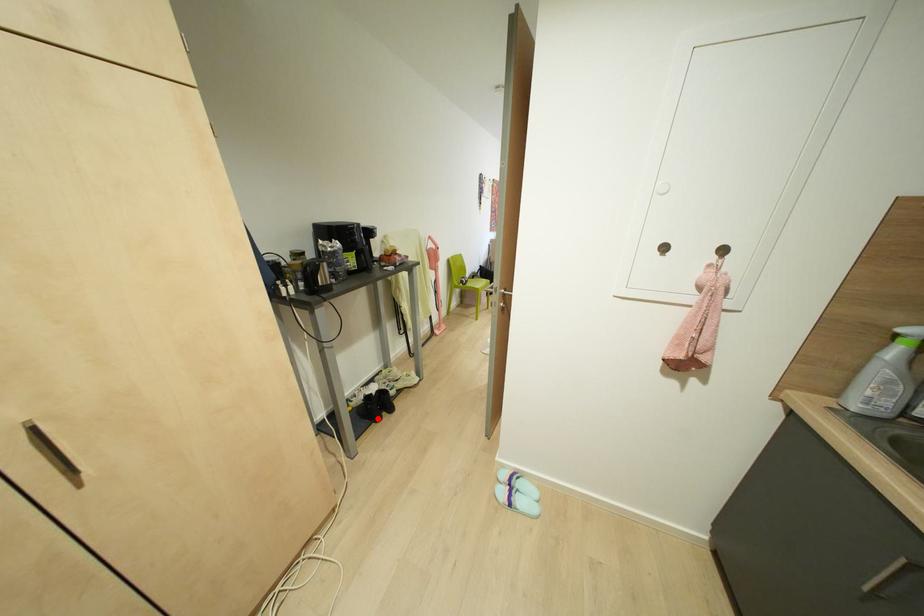
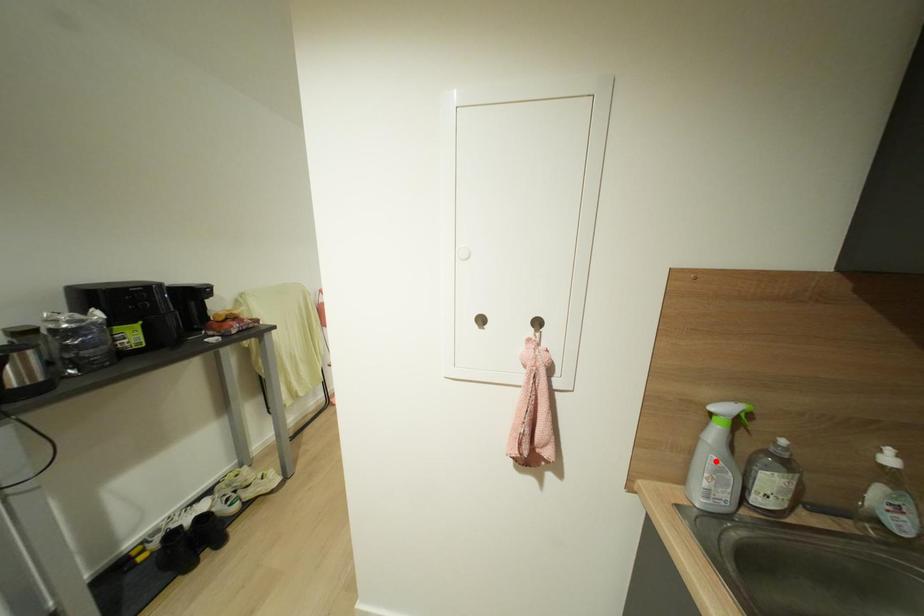
I am providing you with two images of the same scene from different viewpoints. A red point is marked on the first image and another point is marked on the second image. Do the highlighted points in image1 and image2 indicate the same real-world spot?

No